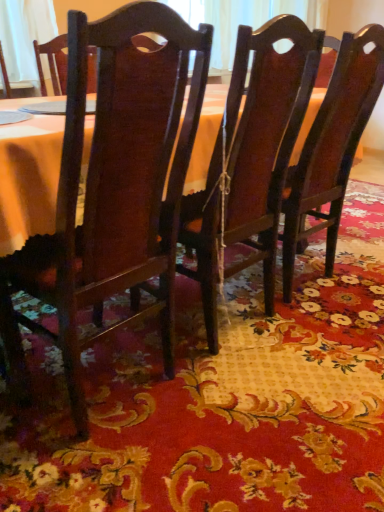
At what (x,y) coordinates should I click in order to perform the action: click on free space in front of matte wood chair at center, which ranks as the 1th chair in left-to-right order. Please return your answer as a coordinate pair (x, y). The height and width of the screenshot is (512, 384). Looking at the image, I should click on (115, 475).